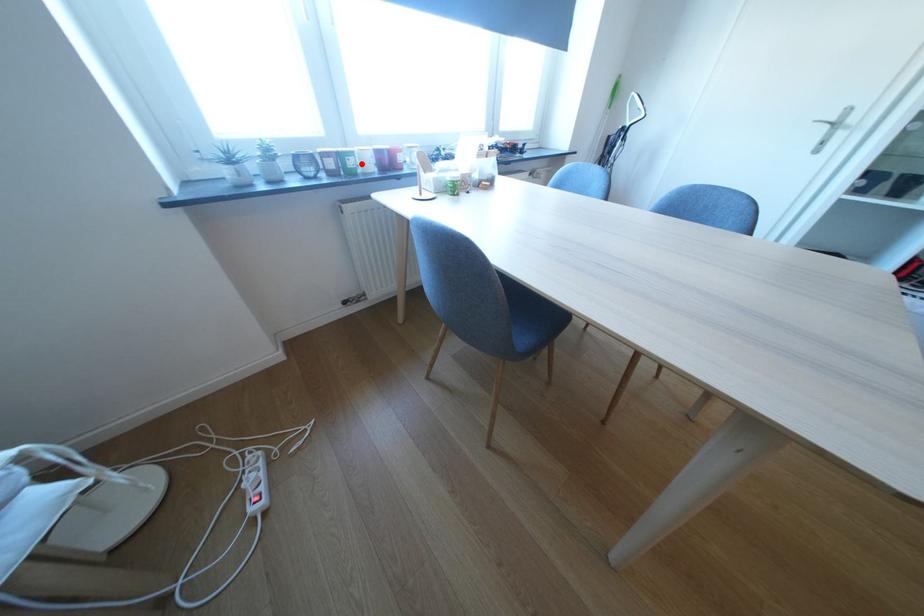
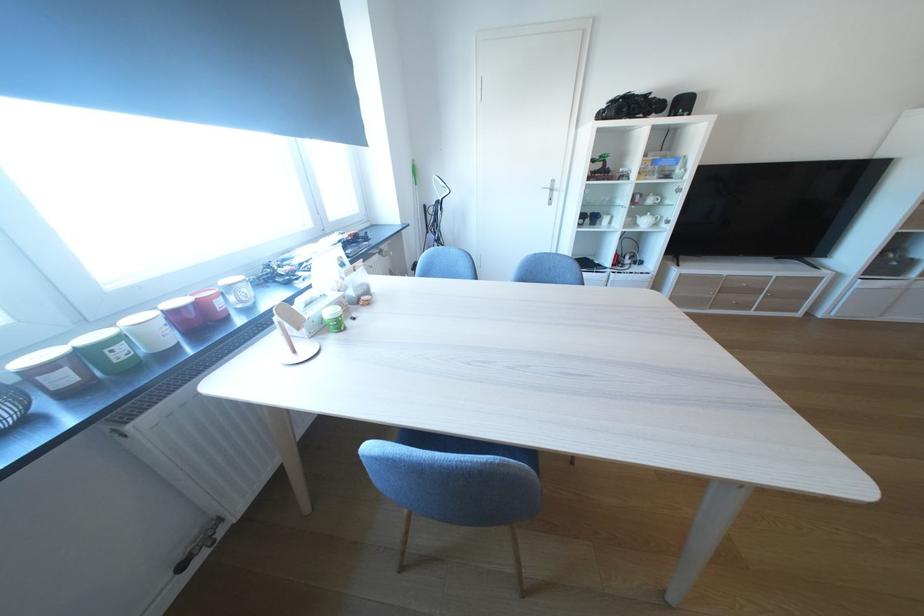
Question: A red point is marked in image1. In image2, is the corresponding 3D point closer to the camera or farther? Reply with the corresponding letter.

Choices:
 (A) The corresponding 3D point is closer.
 (B) The corresponding 3D point is farther.

Answer: (B)